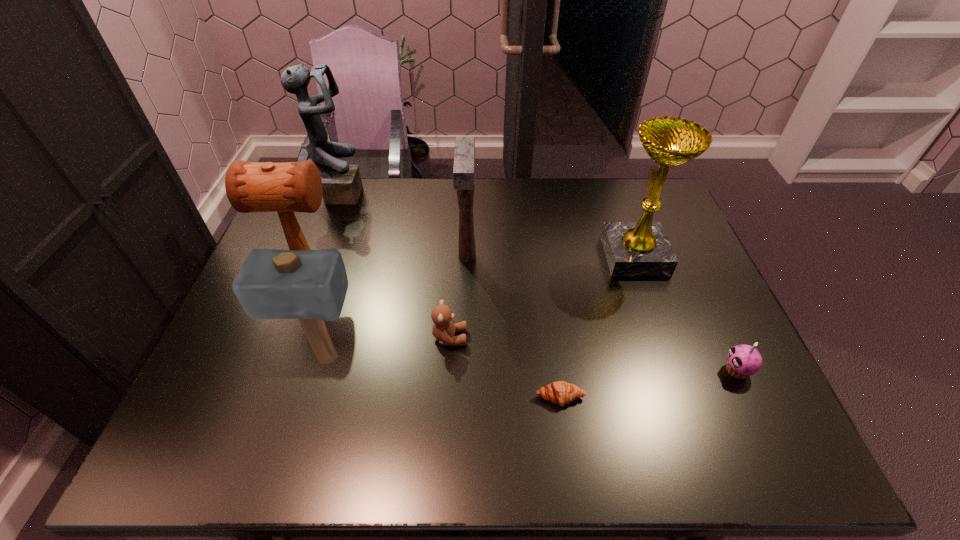
The image size is (960, 540). What are the coordinates of `the farthest object` in the screenshot? It's located at (341, 183).

At what (x,y) coordinates should I click in order to perform the action: click on the seventh object from left to right. Please return your answer as a coordinate pair (x, y). The width and height of the screenshot is (960, 540). Looking at the image, I should click on (642, 248).

Identify the location of the rightmost mallet. Image resolution: width=960 pixels, height=540 pixels. (464, 155).

Identify the location of the nearest mallet. (310, 285).

At what (x,y) coordinates should I click in order to perform the action: click on teddy bear. Please return your answer as a coordinate pair (x, y). Image resolution: width=960 pixels, height=540 pixels. Looking at the image, I should click on (444, 328).

Locate an element on the screen. The width and height of the screenshot is (960, 540). the rightmost object is located at coordinates (743, 360).

Locate an element on the screen. Image resolution: width=960 pixels, height=540 pixels. the nearest object is located at coordinates (560, 392).

Find the location of a particular element. The width and height of the screenshot is (960, 540). pastry is located at coordinates (560, 392).

Identify the location of vacant space located on the face of the farthest object. (435, 192).

Identify the location of vacant space situated 0.190m on the front-facing side of the second object from right to left. (541, 255).